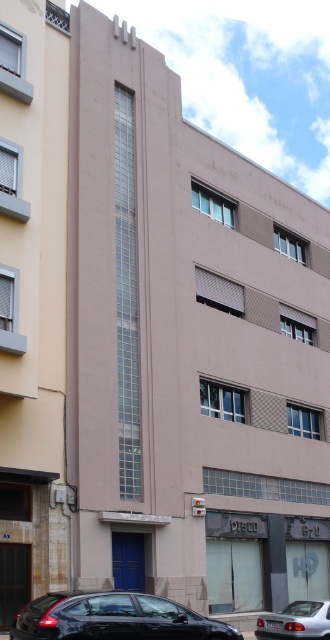
You are a delivery person standing at the entrance of the building. You need to park your delivery van, which is 5 meters long, between the shiny black sedan at center and the shiny black sedan at lower left. Is there enough space between them to park your van?

The distance between the shiny black sedan at center and the shiny black sedan at lower left is 55.59 centimeters. Since the van is 5 meters long, which is much longer than the available space, it won not fit between them.

You are a delivery person trying to park your van between the shiny black sedan at center and the silver metallic car at lower center. Can you fit your van, which is 2 meters wide, between them?

The shiny black sedan at center is above the silver metallic car at lower center, so they are aligned vertically. Since your van is 2 meters wide and the space between them is vertical, the width available horizontally may not be sufficient. However, without specific distance details, it is uncertain. Please check the actual space before attempting to park.

You are a delivery person who needs to park your vehicle between the shiny black sedan at center and the shiny black sedan at lower left. Is there enough space between them to park your van, which is 2 meters wide?

The shiny black sedan at center is to the right of the shiny black sedan at lower left. Since the distance between them isn not specified, it is unclear if there is enough space for a 2 meter wide van. You should check the actual distance before deciding.